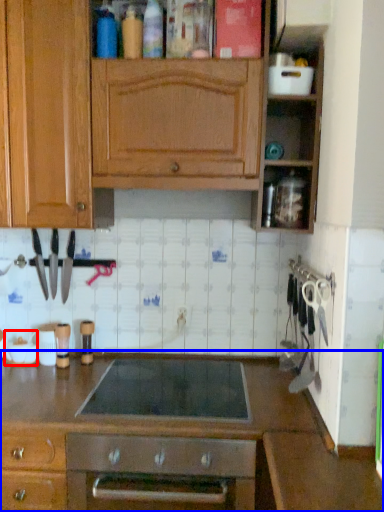
Question: Which object is further to the camera taking this photo, appliance (highlighted by a red box) or countertop (highlighted by a blue box)?

Choices:
 (A) appliance
 (B) countertop

Answer: (A)